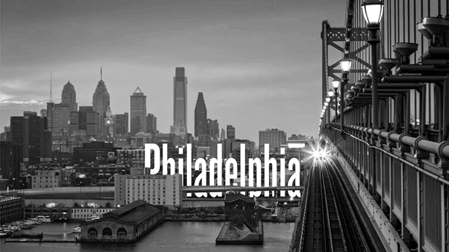
You are a GUI agent. You are given a task and a screenshot of the screen. Output one action in this format:
    pyautogui.click(x=<x>, y=<y>)
    Task: Click on the lamps
    The image size is (449, 252).
    Given the screenshot: What is the action you would take?
    pyautogui.click(x=370, y=14), pyautogui.click(x=344, y=66), pyautogui.click(x=335, y=84)